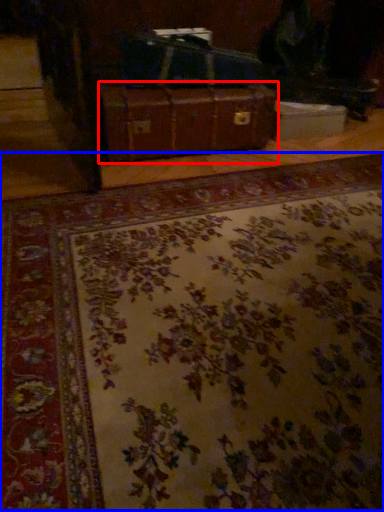
Question: Which object appears farthest to the camera in this image, suitcase (highlighted by a red box) or mat (highlighted by a blue box)?

Choices:
 (A) suitcase
 (B) mat

Answer: (A)